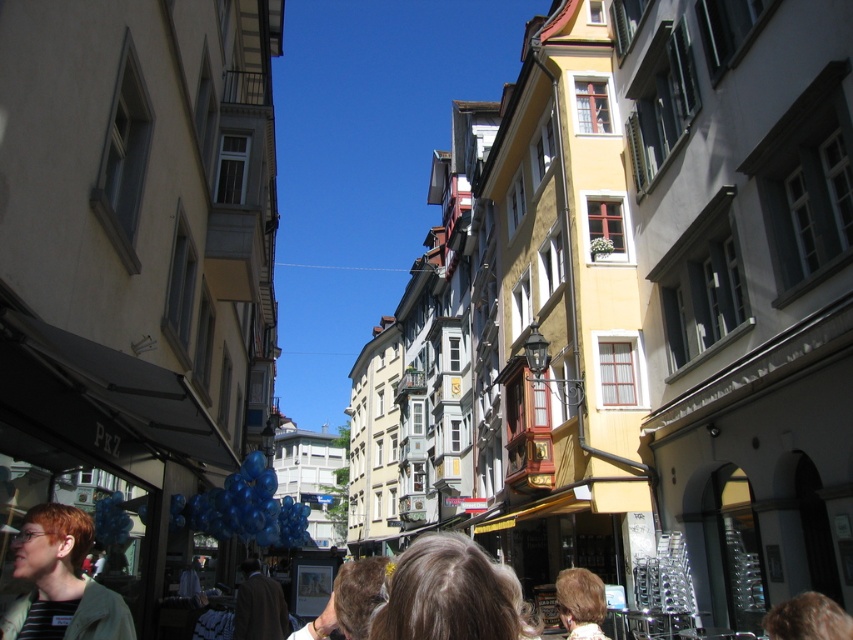
Question: Which point is closer to the camera?

Choices:
 (A) (602, 612)
 (B) (498, 598)

Answer: (B)

Question: Does light brown hair at center have a larger size compared to light brown hair at lower center?

Choices:
 (A) yes
 (B) no

Answer: (A)

Question: Can you confirm if light brown hair at center is thinner than light brown hair at lower center?

Choices:
 (A) yes
 (B) no

Answer: (A)

Question: Which point is closer to the camera taking this photo?

Choices:
 (A) (505, 592)
 (B) (590, 604)

Answer: (A)

Question: Can you confirm if light brown hair at center is thinner than light brown hair at lower center?

Choices:
 (A) yes
 (B) no

Answer: (A)